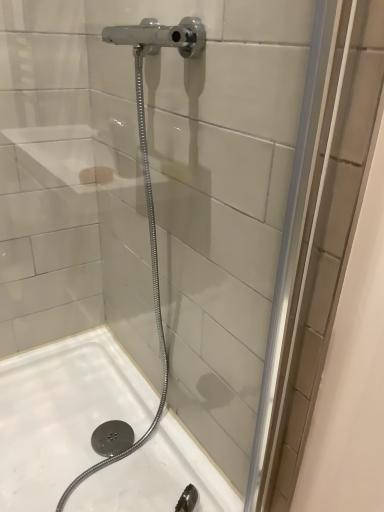
Find the location of a particular element. Image resolution: width=384 pixels, height=512 pixels. white glossy bath at lower center is located at coordinates (63, 414).

What do you see at coordinates (63, 414) in the screenshot? I see `white glossy bath at lower center` at bounding box center [63, 414].

Measure the distance between white glossy bath at lower center and camera.

A distance of 37.81 inches exists between white glossy bath at lower center and camera.

Where is `white glossy bath at lower center`? This screenshot has width=384, height=512. white glossy bath at lower center is located at coordinates (63, 414).